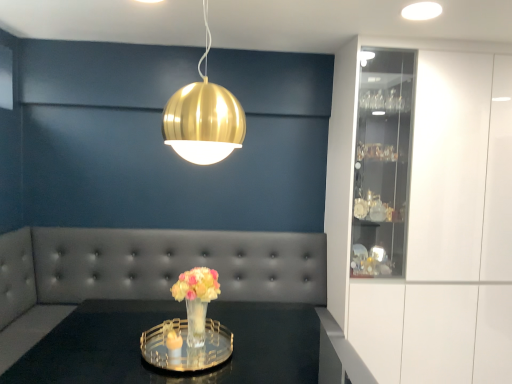
Image resolution: width=512 pixels, height=384 pixels. What do you see at coordinates (160, 323) in the screenshot?
I see `clear glass tray at center` at bounding box center [160, 323].

What is the approximate width of gold metallic sphere at upper center?

13.74 inches.

This screenshot has width=512, height=384. What do you see at coordinates (143, 271) in the screenshot?
I see `tufted leather couch at center` at bounding box center [143, 271].

In order to face tufted leather couch at center, should I rotate leftwards or rightwards?

To align with it, rotate left about 10.867°.

This screenshot has width=512, height=384. Describe the element at coordinates (196, 300) in the screenshot. I see `translucent glass vase at center` at that location.

The image size is (512, 384). What do you see at coordinates (448, 231) in the screenshot?
I see `white glossy cabinet at right` at bounding box center [448, 231].

Identify the location of clear glass tray at center. This screenshot has height=384, width=512. (160, 323).

You are a GUI agent. You are given a task and a screenshot of the screen. Output one action in this format:
    pyautogui.click(x=<x>, y=<y>)
    Task: Click on the lamp above the tufted leather couch at center (from a real-world perspective)
    The width and height of the screenshot is (512, 384).
    Given the screenshot: What is the action you would take?
    pyautogui.click(x=203, y=117)

Is gold metallic sphere at upper center surrounding tufted leather couch at center?

No, tufted leather couch at center is not surrounded by gold metallic sphere at upper center.

Does point (194, 137) come behind point (189, 236)?

That is False.

Between translucent glass vase at center and clear glass tray at center, which one has larger size?

clear glass tray at center.

From the image's perspective, would you say translucent glass vase at center is shown under clear glass tray at center?

Actually, translucent glass vase at center appears above clear glass tray at center in the image.

Between point (189, 281) and point (56, 333), which one is positioned behind?

The point (56, 333) is farther from the camera.

Which of these two, translucent glass vase at center or clear glass tray at center, stands taller?

clear glass tray at center is taller.

From a real-world perspective, relative to white glossy cabinet at right, is translucent glass vase at center vertically above or below?

In terms of real-world spatial position, translucent glass vase at center is below white glossy cabinet at right.

Considering the positions of points (192, 327) and (472, 290), is point (192, 327) farther from camera compared to point (472, 290)?

That is False.

Who is more distant, translucent glass vase at center or white glossy cabinet at right?

white glossy cabinet at right.

Between tufted leather couch at center and white glossy cabinet at right, which one appears on the left side from the viewer's perspective?

From the viewer's perspective, tufted leather couch at center appears more on the left side.

Does tufted leather couch at center have a smaller size compared to white glossy cabinet at right?

Yes.

Is tufted leather couch at center in front of white glossy cabinet at right?

That is True.

Which is nearer, (194, 259) or (438, 348)?

The point (438, 348) is in front.

Based on their sizes in the image, would you say gold metallic sphere at upper center is bigger or smaller than translucent glass vase at center?

In the image, gold metallic sphere at upper center appears to be larger than translucent glass vase at center.

Between gold metallic sphere at upper center and translucent glass vase at center, which one has less height?

translucent glass vase at center.

Is gold metallic sphere at upper center wider or thinner than translucent glass vase at center?

Considering their sizes, gold metallic sphere at upper center looks broader than translucent glass vase at center.

Does translucent glass vase at center turn towards gold metallic sphere at upper center?

No, translucent glass vase at center is not oriented towards gold metallic sphere at upper center.

Can you confirm if translucent glass vase at center is positioned to the left of gold metallic sphere at upper center?

Indeed, translucent glass vase at center is positioned on the left side of gold metallic sphere at upper center.

From a real-world perspective, which is physically below, translucent glass vase at center or gold metallic sphere at upper center?

translucent glass vase at center, from a real-world perspective.

Does translucent glass vase at center come in front of gold metallic sphere at upper center?

No, translucent glass vase at center is behind gold metallic sphere at upper center.

Which is more to the right, gold metallic sphere at upper center or clear glass tray at center?

gold metallic sphere at upper center.

Is gold metallic sphere at upper center positioned far away from clear glass tray at center?

Indeed, gold metallic sphere at upper center is not near clear glass tray at center.

Based on the photo, would you say gold metallic sphere at upper center is outside clear glass tray at center?

gold metallic sphere at upper center lies outside clear glass tray at center's area.

Between gold metallic sphere at upper center and clear glass tray at center, which one has smaller width?

gold metallic sphere at upper center.

This screenshot has width=512, height=384. What are the coordinates of `couch below the gold metallic sphere at upper center (from the image's perspective)` in the screenshot? It's located at (143, 271).

Where is `floral arrangement lying above the clear glass tray at center (from the image's perspective)`? The image size is (512, 384). floral arrangement lying above the clear glass tray at center (from the image's perspective) is located at coordinates (196, 300).

Consider the image. Which object lies nearer to the anchor point gold metallic sphere at upper center, white glossy cabinet at right or translucent glass vase at center?

translucent glass vase at center is positioned closer to the anchor gold metallic sphere at upper center.

Based on their spatial positions, is translucent glass vase at center or white glossy cabinet at right further from clear glass tray at center?

white glossy cabinet at right lies further to clear glass tray at center than the other object.

Looking at this image, from the image, which object appears to be farther from gold metallic sphere at upper center, clear glass tray at center or tufted leather couch at center?

tufted leather couch at center is positioned further to the anchor gold metallic sphere at upper center.

From the image, which object appears to be farther from gold metallic sphere at upper center, white glossy cabinet at right or tufted leather couch at center?

The object further to gold metallic sphere at upper center is white glossy cabinet at right.

From the image, which object appears to be farther from clear glass tray at center, translucent glass vase at center or tufted leather couch at center?

translucent glass vase at center is positioned further to the anchor clear glass tray at center.

When comparing their distances from translucent glass vase at center, does tufted leather couch at center or clear glass tray at center seem further?

tufted leather couch at center is further to translucent glass vase at center.

Consider the image. Looking at the image, which one is located further to gold metallic sphere at upper center, tufted leather couch at center or translucent glass vase at center?

The object further to gold metallic sphere at upper center is tufted leather couch at center.

Considering their positions, is gold metallic sphere at upper center positioned further to clear glass tray at center than translucent glass vase at center?

gold metallic sphere at upper center is further to clear glass tray at center.

Identify the location of floral arrangement situated between clear glass tray at center and white glossy cabinet at right from left to right. Image resolution: width=512 pixels, height=384 pixels. (196, 300).

Where is `floral arrangement that lies between gold metallic sphere at upper center and clear glass tray at center from top to bottom`? The height and width of the screenshot is (384, 512). floral arrangement that lies between gold metallic sphere at upper center and clear glass tray at center from top to bottom is located at coordinates (196, 300).

Locate an element on the screen. lamp situated between clear glass tray at center and white glossy cabinet at right from left to right is located at coordinates [x=203, y=117].

Where is `floral arrangement between gold metallic sphere at upper center and tufted leather couch at center vertically`? The image size is (512, 384). floral arrangement between gold metallic sphere at upper center and tufted leather couch at center vertically is located at coordinates (196, 300).